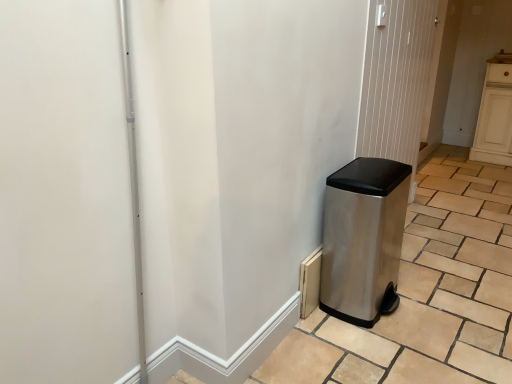
Identify the location of vacant space in front of stainless steel trash can at right. This screenshot has height=384, width=512. (384, 350).